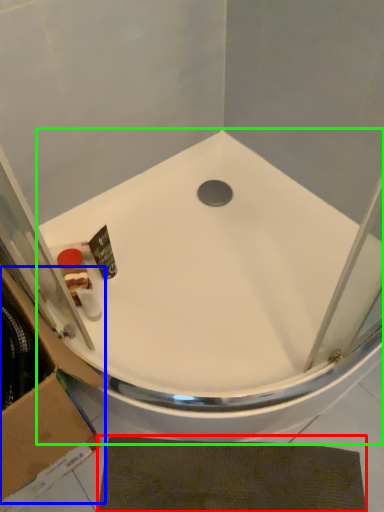
Question: Which object is positioned farthest from bath mat (highlighted by a red box)? Select from cardboard box (highlighted by a blue box) and bathtub (highlighted by a green box).

Choices:
 (A) cardboard box
 (B) bathtub

Answer: (B)